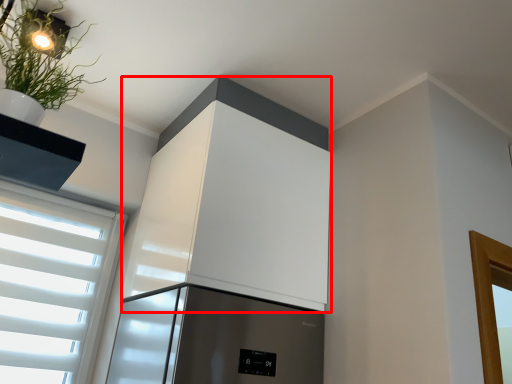
Question: From the image's perspective, where is appliance (annotated by the red box) located relative to houseplant?

Choices:
 (A) above
 (B) below

Answer: (B)